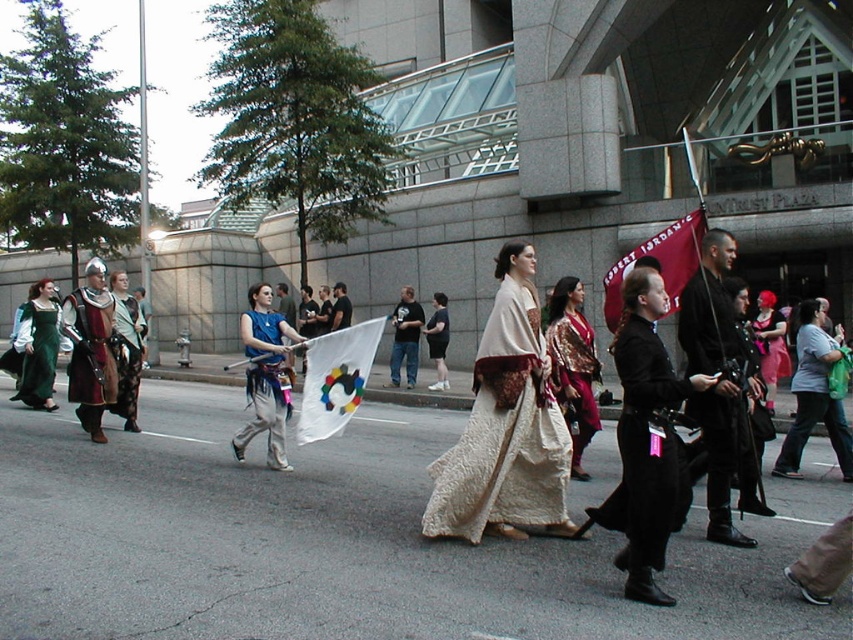
You are a photographer trying to capture both the black velvet cape at center and the silky gold kimono at center in a single frame. Which object should you focus on first to ensure both are in the frame?

The black velvet cape at center is smaller than the silky gold kimono at center, so you should focus on the silky gold kimono at center first to ensure both fit within the frame.

You are a photographer trying to capture a photo of the white textured kimono at center and the red fabric flag at center. Which object is closer to the camera based on their positions?

The white textured kimino at center is positioned under the red fabric flag at center, so the red fabric flag at center is closer to the camera.

You are a photographer positioned at the front of the parade. You want to capture a photo that includes both the red fabric flag at center and the shiny pink fabric at center. Based on their positions, which one should you focus on first to ensure both are in frame?

The red fabric flag at center is above the shiny pink fabric at center, so you should focus on the shiny pink fabric at center first as it is lower and will be in the foreground, ensuring both are captured in the frame.